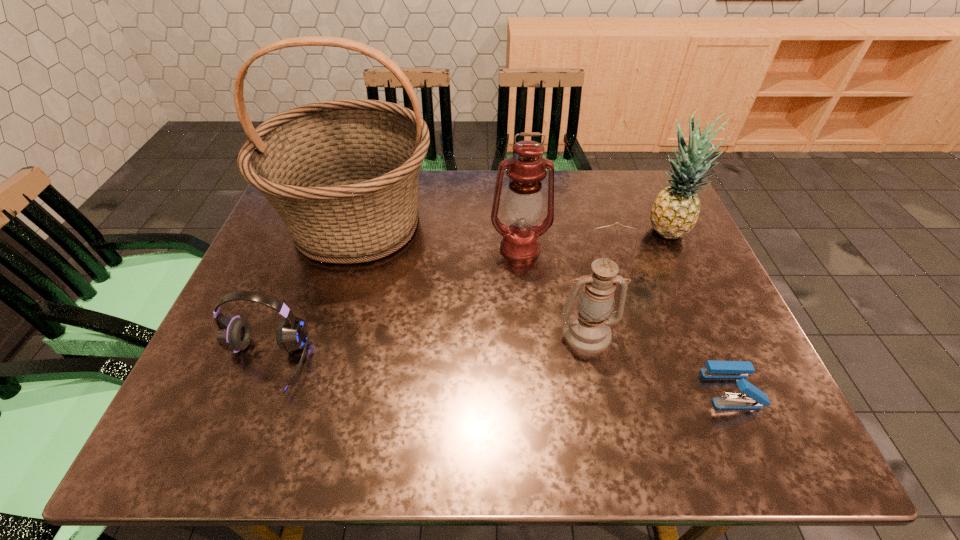
Locate an element on the screen. the tallest object is located at coordinates (343, 175).

The height and width of the screenshot is (540, 960). I want to click on pineapple, so click(675, 211).

Where is `the farther oil lamp`? The image size is (960, 540). the farther oil lamp is located at coordinates (x=523, y=204).

At what (x,y) coordinates should I click in order to perform the action: click on the nearer oil lamp. Please return your answer as a coordinate pair (x, y). This screenshot has height=540, width=960. Looking at the image, I should click on coord(587,330).

You are a GUI agent. You are given a task and a screenshot of the screen. Output one action in this format:
    pyautogui.click(x=<x>, y=<y>)
    Task: Click on the headset
    
    Given the screenshot: What is the action you would take?
    pyautogui.click(x=234, y=334)

Find the location of a particular element. stapler is located at coordinates (753, 398).

This screenshot has width=960, height=540. In order to click on free location located on the right of the basket in this screenshot , I will do `click(514, 223)`.

Find the location of a particular element. The width and height of the screenshot is (960, 540). free space located 0.180m on the front of the pineapple is located at coordinates tap(697, 300).

Image resolution: width=960 pixels, height=540 pixels. I want to click on free location located on the back of the farther oil lamp, so click(x=516, y=207).

Where is `blank space located 0.240m on the right of the nearer oil lamp`? This screenshot has height=540, width=960. blank space located 0.240m on the right of the nearer oil lamp is located at coordinates (723, 333).